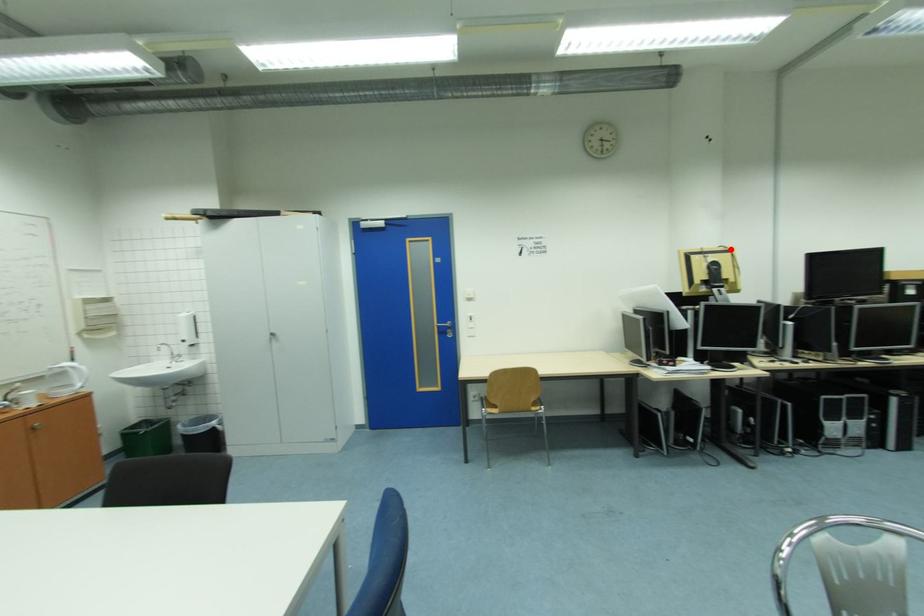
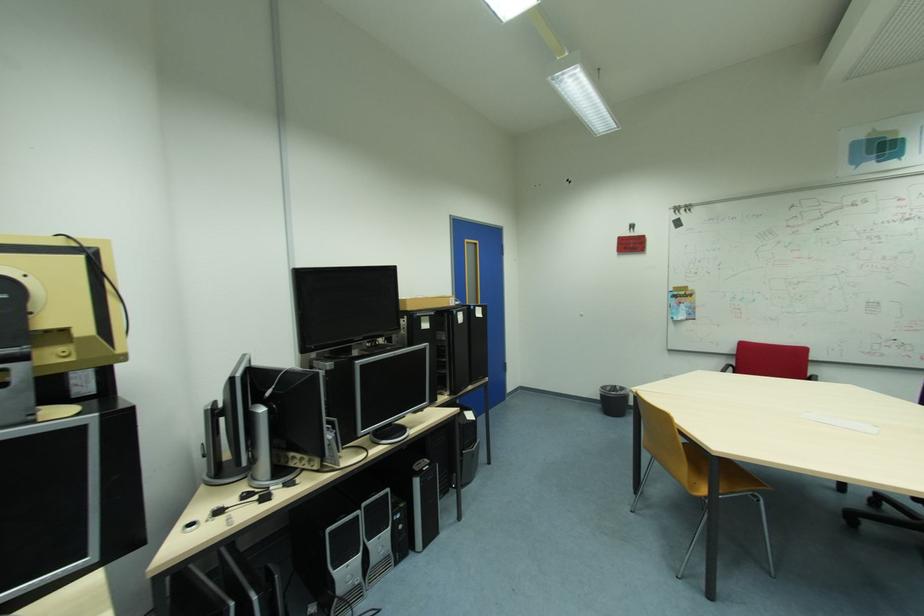
Locate, in the second image, the point that corresponds to the highlighted location in the first image.

(66, 244)